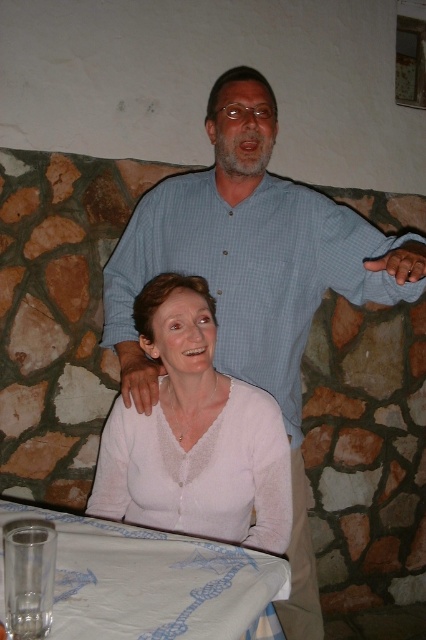
Question: Among these points, which one is nearest to the camera?

Choices:
 (A) 282,273
 (B) 71,586

Answer: (B)

Question: Does white sheer blouse at center come in front of transparent glass at lower left?

Choices:
 (A) no
 (B) yes

Answer: (A)

Question: Is light blue checkered shirt at upper center above white sheer blouse at center?

Choices:
 (A) yes
 (B) no

Answer: (A)

Question: Is the position of light blue checkered shirt at upper center more distant than that of white sheer blouse at center?

Choices:
 (A) yes
 (B) no

Answer: (B)

Question: Which point is farther from the camera taking this photo?

Choices:
 (A) (127, 630)
 (B) (219, 404)
 (C) (354, 250)

Answer: (C)

Question: Which point is closer to the camera?

Choices:
 (A) (285, 321)
 (B) (204, 458)
 (C) (256, 595)

Answer: (C)